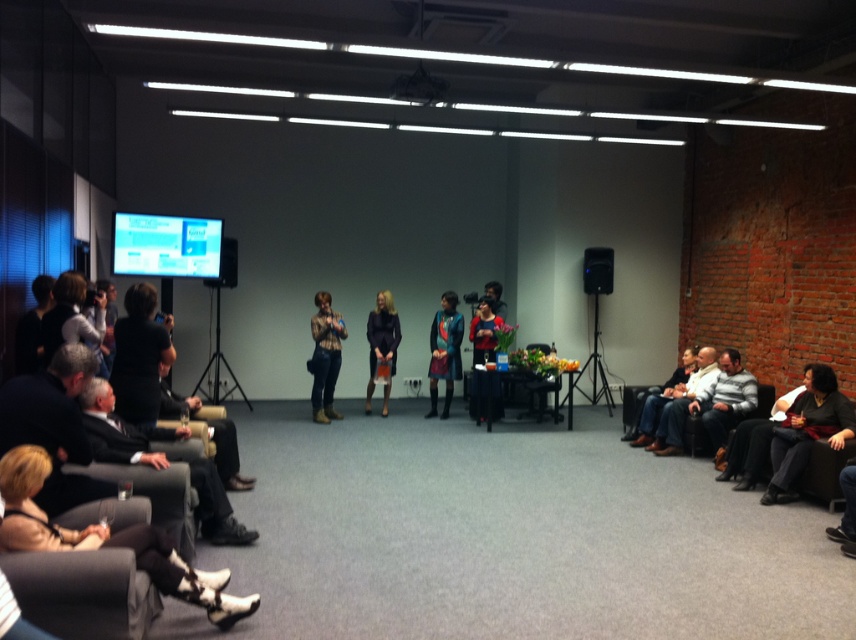
You are an event planner setting up for a presentation. You need to place a 1.2 meter wide banner between the dark gray fabric chair at lower left and the matte black jacket at center. Will the banner fit if the space between them is the same as the chair and jacket sizes?

The dark gray fabric chair at lower left is larger in size than the matte black jacket at center. The banner is 1.2 meters wide. However, the exact dimensions of the chair and jacket are not provided, so it is impossible to determine if the space between them can accommodate the banner.

You are an event organizer who needs to adjust the setup. You want to place a new decorative item on the jeans at right without blocking the black plastic speaker at right. Where should you place the item?

Place the decorative item on the jeans at right below the black plastic speaker at right, since the jeans at right is positioned under the speaker, allowing space above it for placement without obstruction.

Based on the photo, you are an event organizer setting up chairs for an audience. You need to place a chair between the jeans at right and the black plastic speaker at right. Is this possible?

The jeans at right is to the right of the black plastic speaker at right, so there is space between them. You can place a chair between the jeans at right and the black plastic speaker at right.